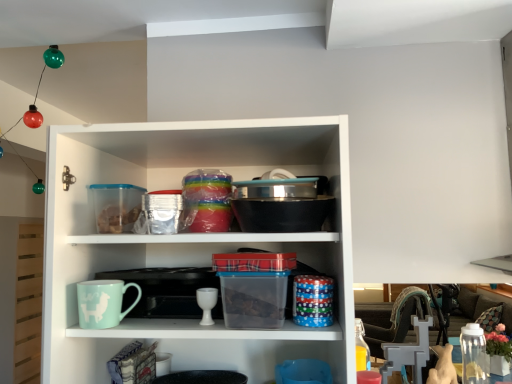
Find the location of `light blue ceramic mug at lower left`. light blue ceramic mug at lower left is located at coordinates (103, 303).

The height and width of the screenshot is (384, 512). In order to click on clear plastic jar at lower right in this screenshot , I will do `click(474, 355)`.

The width and height of the screenshot is (512, 384). Describe the element at coordinates (474, 355) in the screenshot. I see `clear plastic jar at lower right` at that location.

This screenshot has height=384, width=512. What do you see at coordinates (206, 303) in the screenshot? I see `white glossy goblet at center` at bounding box center [206, 303].

The image size is (512, 384). I want to click on light blue ceramic mug at lower left, so click(103, 303).

In terms of width, does white glossy goblet at center look wider or thinner when compared to light blue ceramic mug at lower left?

In the image, white glossy goblet at center appears to be more narrow than light blue ceramic mug at lower left.

From the image's perspective, is white glossy goblet at center located above or below light blue ceramic mug at lower left?

Clearly, from the image's perspective, white glossy goblet at center is below light blue ceramic mug at lower left.

Which is more to the right, white glossy goblet at center or light blue ceramic mug at lower left?

white glossy goblet at center.

Does light blue ceramic mug at lower left have a larger size compared to clear plastic jar at lower right?

Incorrect, light blue ceramic mug at lower left is not larger than clear plastic jar at lower right.

From a real-world perspective, which object rests below the other?

clear plastic jar at lower right is physically lower.

Is light blue ceramic mug at lower left with clear plastic jar at lower right?

No, light blue ceramic mug at lower left is not in contact with clear plastic jar at lower right.

How different are the orientations of light blue ceramic mug at lower left and clear plastic jar at lower right in degrees?

There is a 0.375-degree angle between the facing directions of light blue ceramic mug at lower left and clear plastic jar at lower right.

How many degrees apart are the facing directions of clear plastic jar at lower right and light blue ceramic mug at lower left?

They differ by 0.375 degrees in their facing directions.

Considering the sizes of objects clear plastic jar at lower right and light blue ceramic mug at lower left in the image provided, who is bigger, clear plastic jar at lower right or light blue ceramic mug at lower left?

clear plastic jar at lower right is bigger.

In the image, there is a light blue ceramic mug at lower left. Where is `glass jar below it (from a real-world perspective)`? glass jar below it (from a real-world perspective) is located at coordinates (474, 355).

Between clear plastic jar at lower right and light blue ceramic mug at lower left, which one has less height?

light blue ceramic mug at lower left.

Does point (462, 352) lie in front of point (206, 318)?

No, it is not.

From the image's perspective, which is below, clear plastic jar at lower right or white glossy goblet at center?

clear plastic jar at lower right.

Is clear plastic jar at lower right touching white glossy goblet at center?

No, clear plastic jar at lower right is not touching white glossy goblet at center.

From the image's perspective, between white glossy goblet at center and clear plastic jar at lower right, which one is located above?

white glossy goblet at center is shown above in the image.

Considering the sizes of white glossy goblet at center and clear plastic jar at lower right in the image, is white glossy goblet at center taller or shorter than clear plastic jar at lower right?

In the image, white glossy goblet at center appears to be shorter than clear plastic jar at lower right.

From the picture: Is white glossy goblet at center facing away from clear plastic jar at lower right?

No.

Is light blue ceramic mug at lower left not close to white glossy goblet at center?

No, light blue ceramic mug at lower left is not far from white glossy goblet at center.

Between light blue ceramic mug at lower left and white glossy goblet at center, which one has larger width?

Wider between the two is light blue ceramic mug at lower left.

This screenshot has width=512, height=384. Identify the location of tableware that appears behind the light blue ceramic mug at lower left. (206, 303).

There is a clear plastic jar at lower right. In order to click on mug above it (from a real-world perspective) in this screenshot , I will do `click(103, 303)`.

When comparing their distances from white glossy goblet at center, does light blue ceramic mug at lower left or clear plastic jar at lower right seem further?

Based on the image, clear plastic jar at lower right appears to be further to white glossy goblet at center.

In the scene shown: Looking at the image, which one is located further to light blue ceramic mug at lower left, clear plastic jar at lower right or white glossy goblet at center?

The object further to light blue ceramic mug at lower left is clear plastic jar at lower right.

Estimate the real-world distances between objects in this image. Which object is closer to white glossy goblet at center, clear plastic jar at lower right or light blue ceramic mug at lower left?

light blue ceramic mug at lower left is positioned closer to the anchor white glossy goblet at center.

Which object lies further to the anchor point clear plastic jar at lower right, white glossy goblet at center or light blue ceramic mug at lower left?

white glossy goblet at center lies further to clear plastic jar at lower right than the other object.

Looking at the image, which one is located further to clear plastic jar at lower right, light blue ceramic mug at lower left or white glossy goblet at center?

white glossy goblet at center is positioned further to the anchor clear plastic jar at lower right.

From the image, which object appears to be nearer to light blue ceramic mug at lower left, white glossy goblet at center or clear plastic jar at lower right?

white glossy goblet at center is closer to light blue ceramic mug at lower left.

Locate an element on the screen. The height and width of the screenshot is (384, 512). tableware situated between light blue ceramic mug at lower left and clear plastic jar at lower right from left to right is located at coordinates (206, 303).